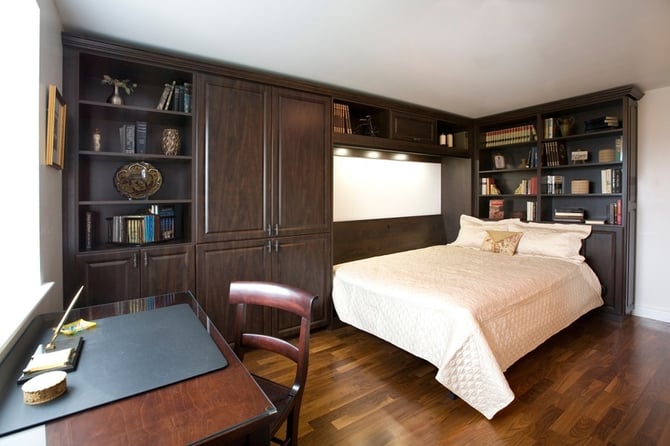
Identify the location of comforter. tap(450, 279).